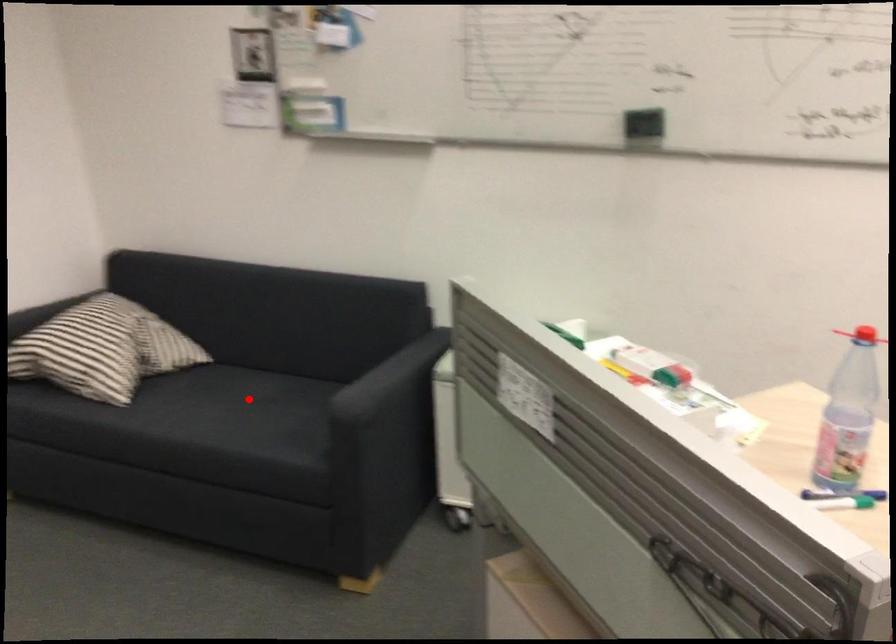
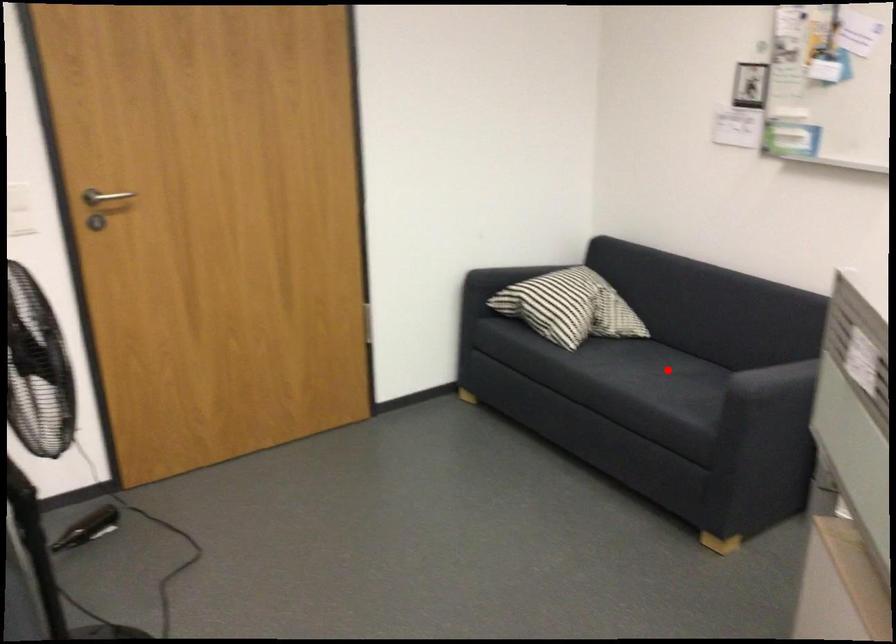
I am providing you with two images of the same scene from different viewpoints. A red point is marked on the first image and another point is marked on the second image. Is the red point in image1 aligned with the point shown in image2?

Yes